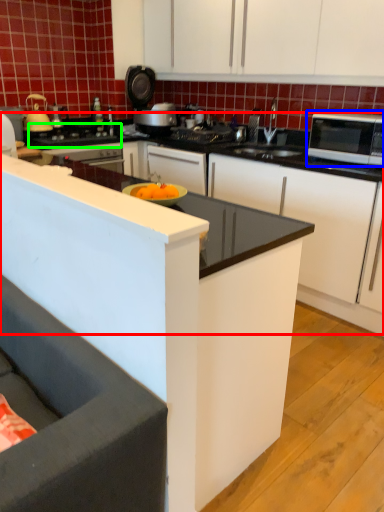
Question: Which is farther away from counter (highlighted by a red box)? microwave oven (highlighted by a blue box) or gas stove (highlighted by a green box)?

Choices:
 (A) microwave oven
 (B) gas stove

Answer: (B)